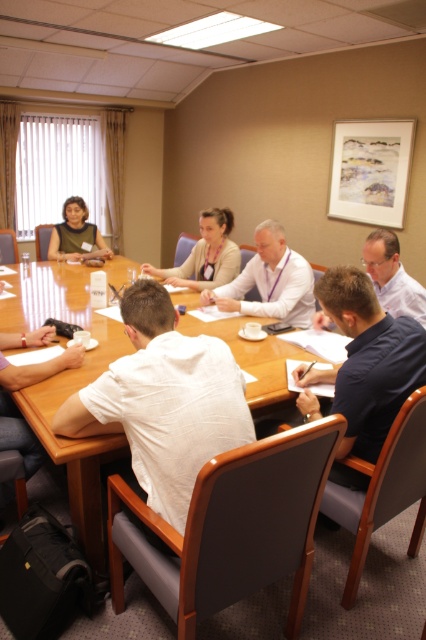
Can you confirm if matte beige sweater at center is positioned above matte black shirt at upper left?

No.

Looking at this image, can you confirm if matte beige sweater at center is wider than matte black shirt at upper left?

Correct, the width of matte beige sweater at center exceeds that of matte black shirt at upper left.

Does point (201, 234) lie behind point (75, 196)?

No.

Where is `matte beige sweater at center`? Image resolution: width=426 pixels, height=640 pixels. matte beige sweater at center is located at coordinates (206, 256).

Can you confirm if wooden table at center is positioned above light blue shirt at center?

Actually, wooden table at center is below light blue shirt at center.

Is point (236, 326) positioned after point (417, 285)?

Yes.

Find the location of a particular element. wooden table at center is located at coordinates (69, 388).

Does wooden table at center have a greater width compared to white shirt at center?

Correct, the width of wooden table at center exceeds that of white shirt at center.

Which of these two, wooden table at center or white shirt at center, stands taller?

With more height is wooden table at center.

Which is behind, point (95, 328) or point (279, 230)?

Point (279, 230)

The width and height of the screenshot is (426, 640). What are the coordinates of `wooden table at center` in the screenshot? It's located at (69, 388).